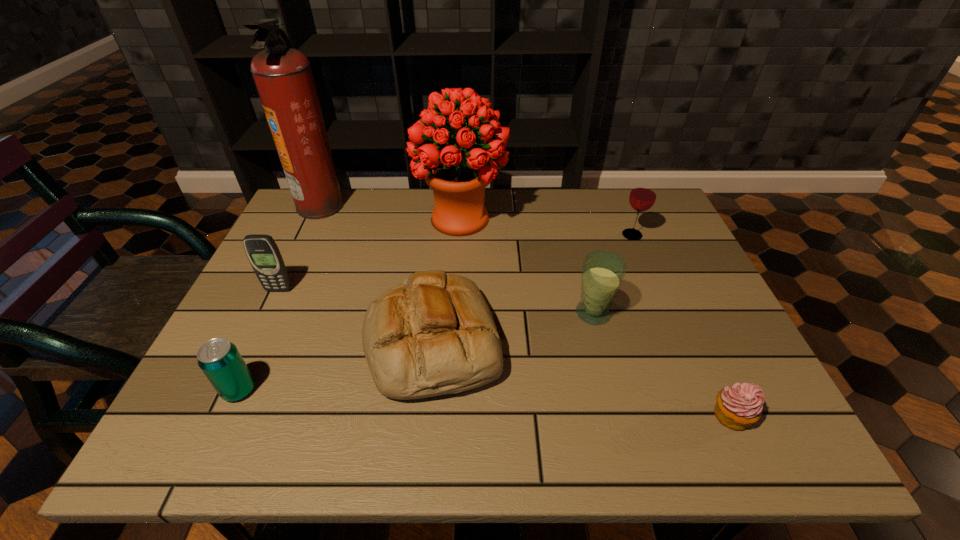
I want to click on the tallest object, so click(283, 77).

Identify the location of bouquet. This screenshot has height=540, width=960. (458, 178).

Locate an element on the screen. This screenshot has height=540, width=960. the right glass is located at coordinates (642, 197).

The width and height of the screenshot is (960, 540). What are the coordinates of `cellular telephone` in the screenshot? It's located at 263,253.

Identify the location of the left glass. The width and height of the screenshot is (960, 540). (603, 271).

Identify the location of the third object from right to left. The width and height of the screenshot is (960, 540). (603, 271).

At what (x,y) coordinates should I click in order to perform the action: click on bread. Please return your answer as a coordinate pair (x, y). This screenshot has width=960, height=540. Looking at the image, I should click on (434, 334).

Locate an element on the screen. The height and width of the screenshot is (540, 960). beer can is located at coordinates (219, 359).

This screenshot has width=960, height=540. Find the location of `the shortest object`. the shortest object is located at coordinates (739, 406).

At what (x,y) coordinates should I click in order to perform the action: click on free region located at the nozzle of the fire extinguisher. Please return your answer as a coordinate pair (x, y). The height and width of the screenshot is (540, 960). Looking at the image, I should click on (398, 205).